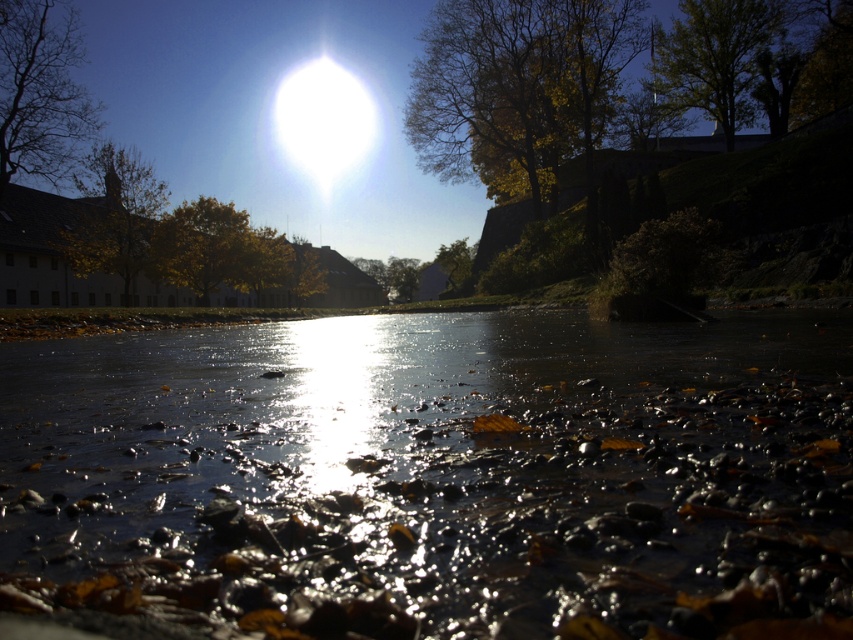
Does yellow-green foliage at upper center appear under white glossy sun at upper center?

Indeed, yellow-green foliage at upper center is positioned under white glossy sun at upper center.

Does yellow-green foliage at upper center have a greater width compared to white glossy sun at upper center?

No, yellow-green foliage at upper center is not wider than white glossy sun at upper center.

Does point (538, 84) come in front of point (358, 83)?

That is True.

Where is `yellow-green foliage at upper center`? The image size is (853, 640). yellow-green foliage at upper center is located at coordinates (518, 88).

Can you confirm if green leafy tree at upper right is positioned below golden leafy tree at left?

No.

Which is in front, point (720, 128) or point (138, 186)?

Positioned in front is point (138, 186).

The width and height of the screenshot is (853, 640). Describe the element at coordinates (715, 58) in the screenshot. I see `green leafy tree at upper right` at that location.

In order to click on green leafy tree at upper right in this screenshot , I will do `click(715, 58)`.

Who is more distant from viewer, (x=129, y=253) or (x=308, y=76)?

The point (x=308, y=76) is more distant.

Does golden leafy tree at left lie in front of white glossy sun at upper center?

Yes, it is in front of white glossy sun at upper center.

What are the coordinates of `golden leafy tree at left` in the screenshot? It's located at (115, 216).